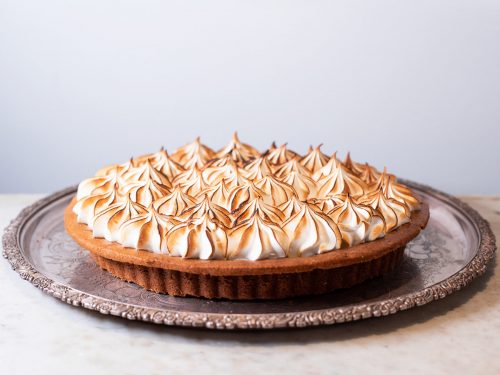
The image size is (500, 375). I want to click on table, so point(74,351).